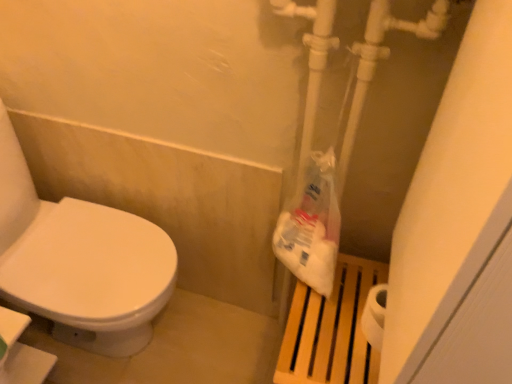
Question: Considering the relative sizes of wooden slats at right and white plastic bag at right in the image provided, is wooden slats at right taller than white plastic bag at right?

Choices:
 (A) no
 (B) yes

Answer: (B)

Question: Would you consider wooden slats at right to be distant from white plastic bag at right?

Choices:
 (A) yes
 (B) no

Answer: (B)

Question: Can you confirm if wooden slats at right is positioned to the left of white plastic bag at right?

Choices:
 (A) yes
 (B) no

Answer: (B)

Question: From the image's perspective, is wooden slats at right above white plastic bag at right?

Choices:
 (A) no
 (B) yes

Answer: (A)

Question: Is wooden slats at right looking in the opposite direction of white plastic bag at right?

Choices:
 (A) yes
 (B) no

Answer: (B)

Question: Can you confirm if wooden slats at right is wider than white plastic bag at right?

Choices:
 (A) no
 (B) yes

Answer: (B)

Question: Can you confirm if white plastic bag at right is taller than wooden slats at right?

Choices:
 (A) no
 (B) yes

Answer: (A)

Question: Does white plastic bag at right have a lesser width compared to wooden slats at right?

Choices:
 (A) no
 (B) yes

Answer: (B)

Question: Is white plastic bag at right at the left side of wooden slats at right?

Choices:
 (A) no
 (B) yes

Answer: (B)

Question: Is white plastic bag at right bigger than wooden slats at right?

Choices:
 (A) no
 (B) yes

Answer: (A)

Question: Does white plastic bag at right lie in front of wooden slats at right?

Choices:
 (A) yes
 (B) no

Answer: (A)

Question: From a real-world perspective, is white plastic bag at right beneath wooden slats at right?

Choices:
 (A) yes
 (B) no

Answer: (B)

Question: Is white plastic bag at right to the left or to the right of wooden slats at right in the image?

Choices:
 (A) left
 (B) right

Answer: (A)